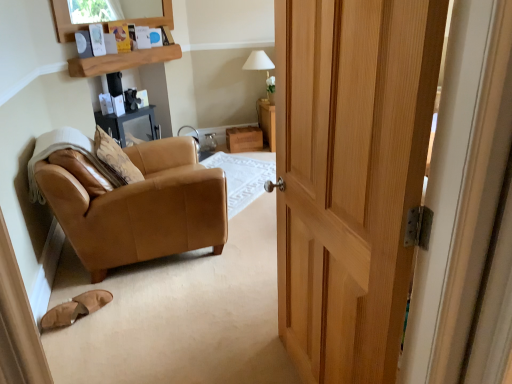
The width and height of the screenshot is (512, 384). What are the coordinates of `free region under tan suede slippers at lower left (from a real-world perspective)` in the screenshot? It's located at (95, 307).